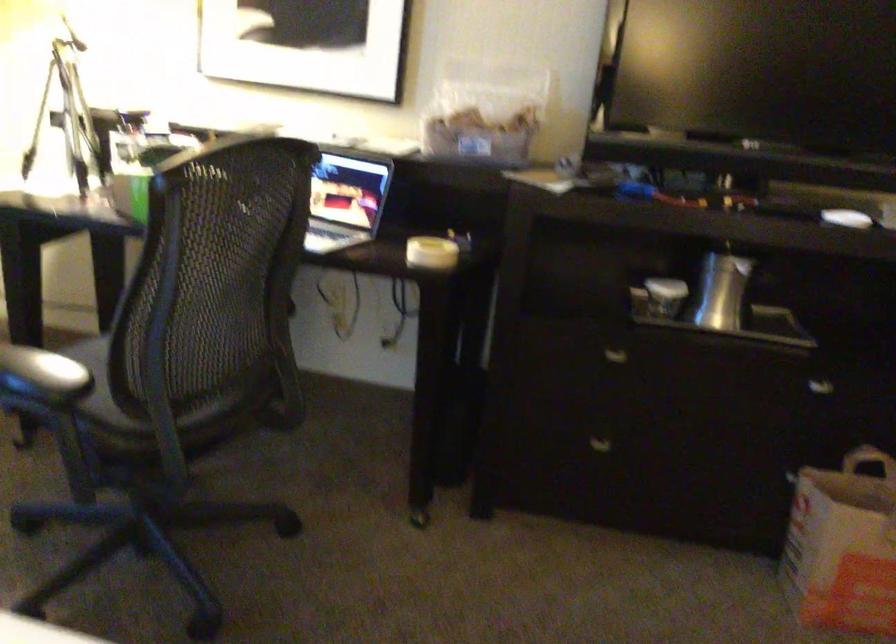
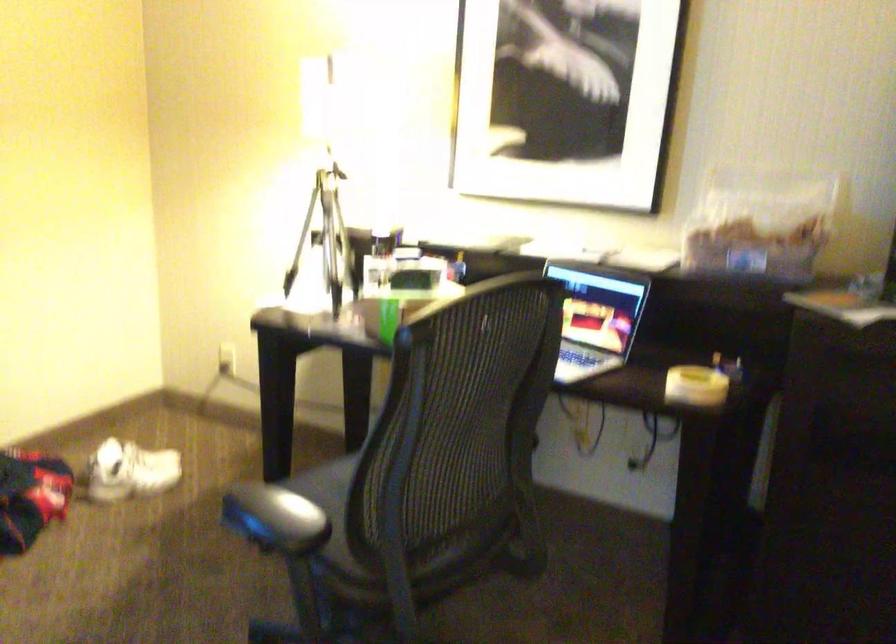
Question: The camera is either moving clockwise (left) or counter-clockwise (right) around the object. The first image is from the beginning of the video and the second image is from the end. Is the camera moving left or right when shooting the video?

Choices:
 (A) Left
 (B) Right

Answer: (B)